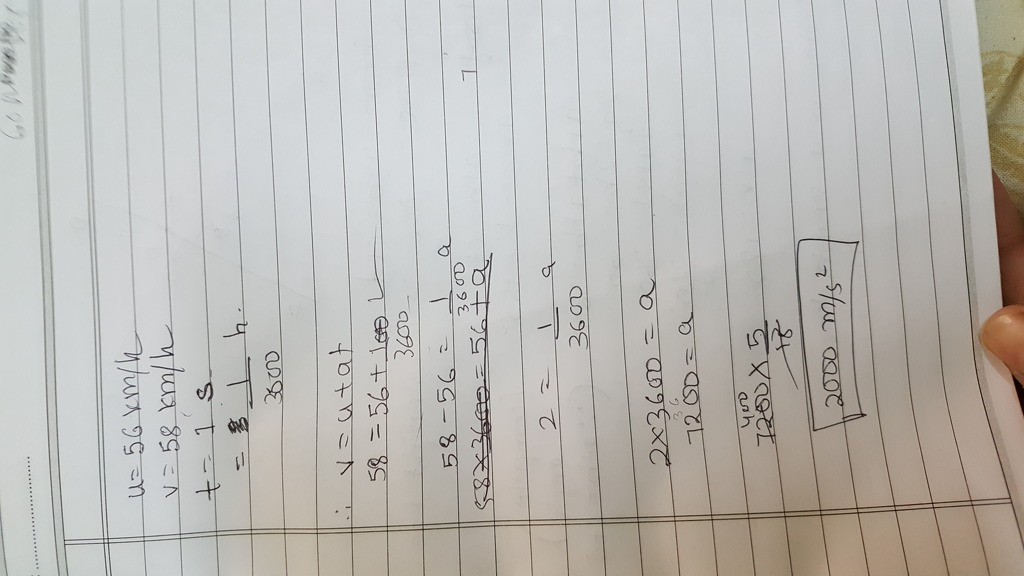
Where is `box`? box is located at coordinates (261, 464).